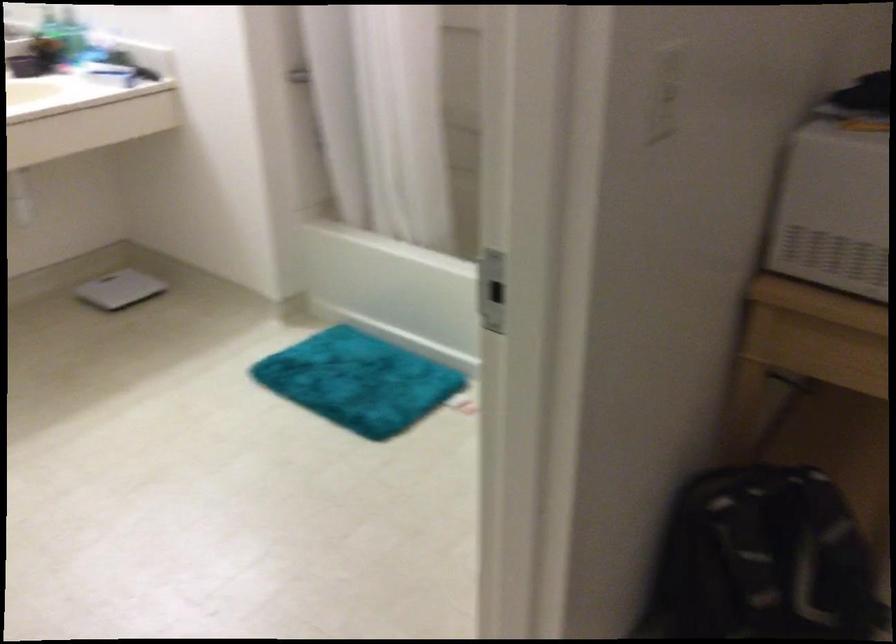
Identify the location of white light switch. This screenshot has width=896, height=644. (666, 93).